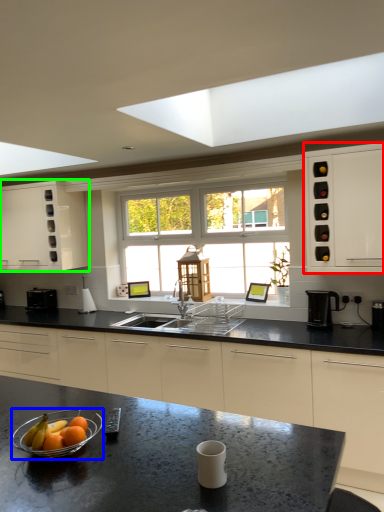
Question: Based on their relative distances, which object is farther from cabinetry (highlighted by a red box)? Choose from glass bowl (highlighted by a blue box) and cabinetry (highlighted by a green box).

Choices:
 (A) glass bowl
 (B) cabinetry

Answer: (B)